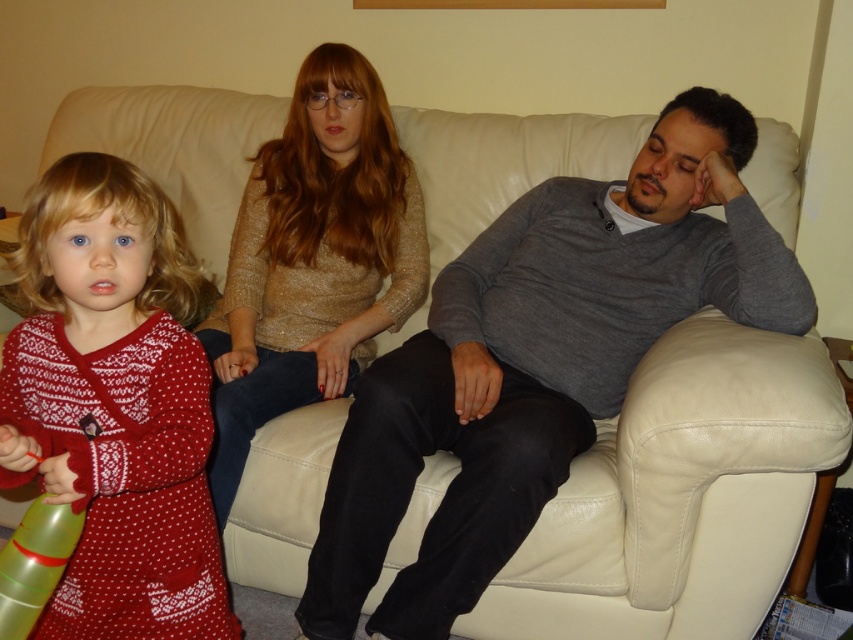
You are standing in the living room and want to place a small plant pot exactly at the point marked as point (601, 404). Considering the current arrangement of the sofa and people, is there enough space to place the pot there without disturbing anyone?

The point (601, 404) is 4.99 feet away from the viewer, so there is enough space to place the small plant pot there without disturbing anyone.

You are a fashion designer observing the scene and want to create a layered look using the gray matte sweater at center and the shiny gold sweater at center. Which sweater should you place on top to achieve this layered appearance?

The gray matte sweater at center should be placed on top because it is in front of the shiny gold sweater at center, creating a layered look.